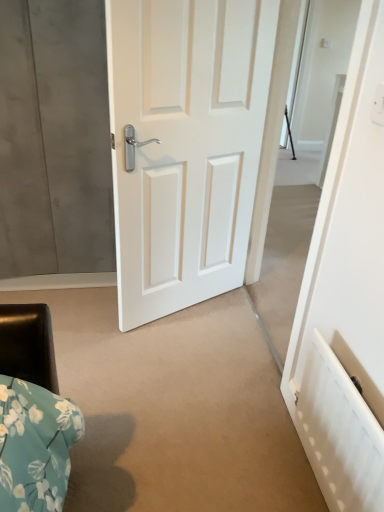
Question: Does point (205, 359) appear closer or farther from the camera than point (137, 138)?

Choices:
 (A) farther
 (B) closer

Answer: (A)

Question: Choose the correct answer: Is matte white door at center inside white glossy door at center or outside it?

Choices:
 (A) outside
 (B) inside

Answer: (A)

Question: Considering the real-world distances, which object is closest to the white glossy door at center?

Choices:
 (A) matte white door at center
 (B) white textured radiator at lower right

Answer: (A)

Question: Which object is the farthest from the matte white door at center?

Choices:
 (A) white glossy door at center
 (B) white textured radiator at lower right

Answer: (A)